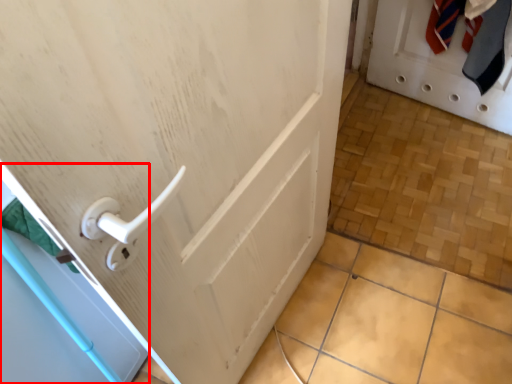
Question: Observing the image, what is the correct spatial positioning of screen door (annotated by the red box) in reference to door?

Choices:
 (A) right
 (B) left

Answer: (B)